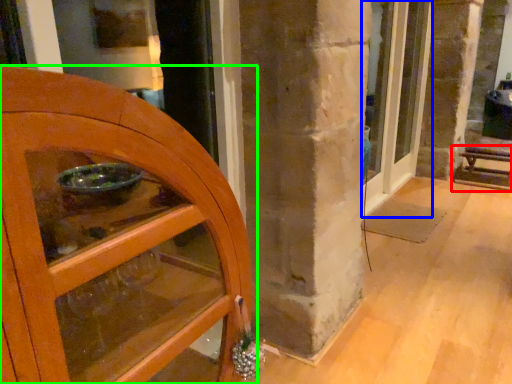
Question: Estimate the real-world distances between objects in this image. Which object is farther from furniture (highlighted by a red box), door (highlighted by a blue box) or door (highlighted by a green box)?

Choices:
 (A) door
 (B) door

Answer: (B)